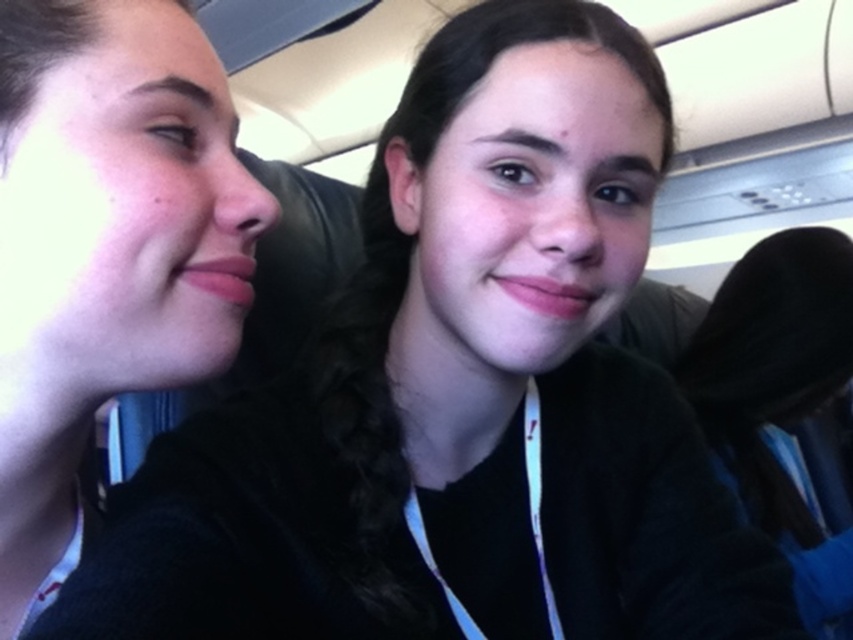
Question: Does black fabric at left come behind black fabric at right?

Choices:
 (A) no
 (B) yes

Answer: (A)

Question: Which point is closer to the camera?

Choices:
 (A) black fabric at right
 (B) black fabric at left

Answer: (B)

Question: Can you confirm if black fabric at left is smaller than black fabric at right?

Choices:
 (A) no
 (B) yes

Answer: (B)

Question: Is black fabric at left above black fabric at right?

Choices:
 (A) no
 (B) yes

Answer: (B)